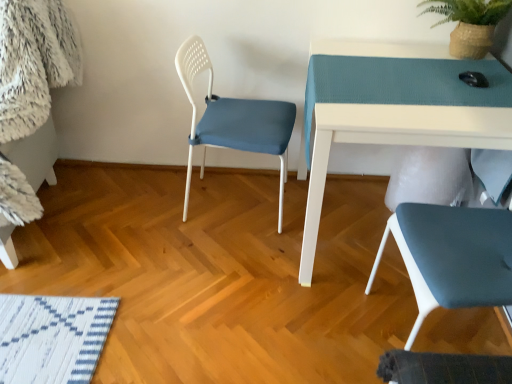
Find the location of a particular element. The image size is (512, 384). blank area beneath matte blue chair at lower right, placed as the 1th chair when sorted from right to left (from a real-world perspective) is located at coordinates (431, 329).